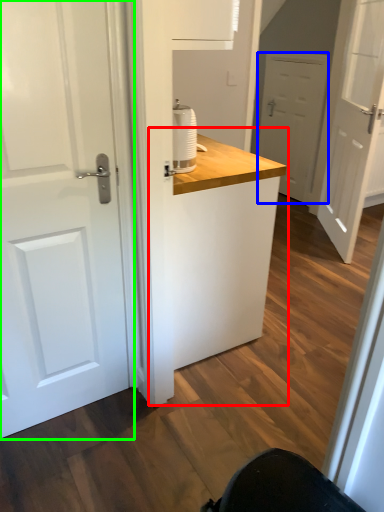
Question: Which object is the closest to the counter (highlighted by a red box)? Choose among these: door (highlighted by a blue box) or door (highlighted by a green box).

Choices:
 (A) door
 (B) door

Answer: (B)